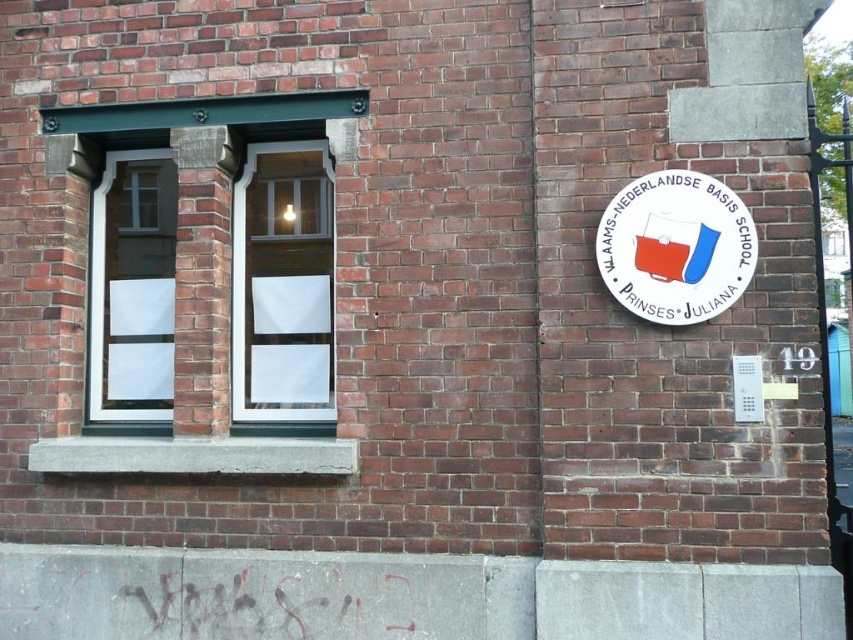
You are a delivery person approaching the building and need to read the signboard. Can you see the white plastic sign at right clearly through the white glass window at center?

The white plastic sign at right is behind the white glass window at center, so it is positioned behind the window. Since the window has white paper covering its panes, the sign cannot be seen clearly through the window.